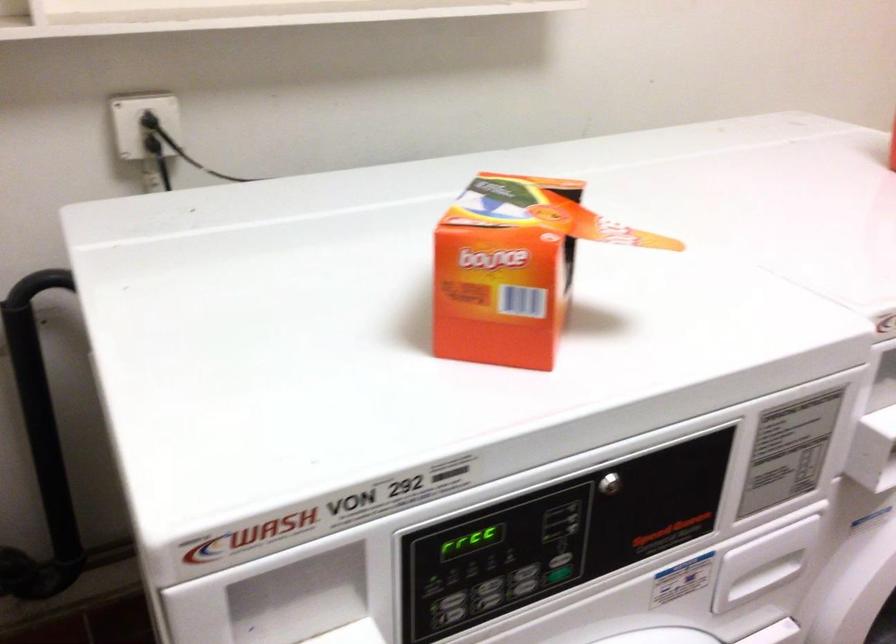
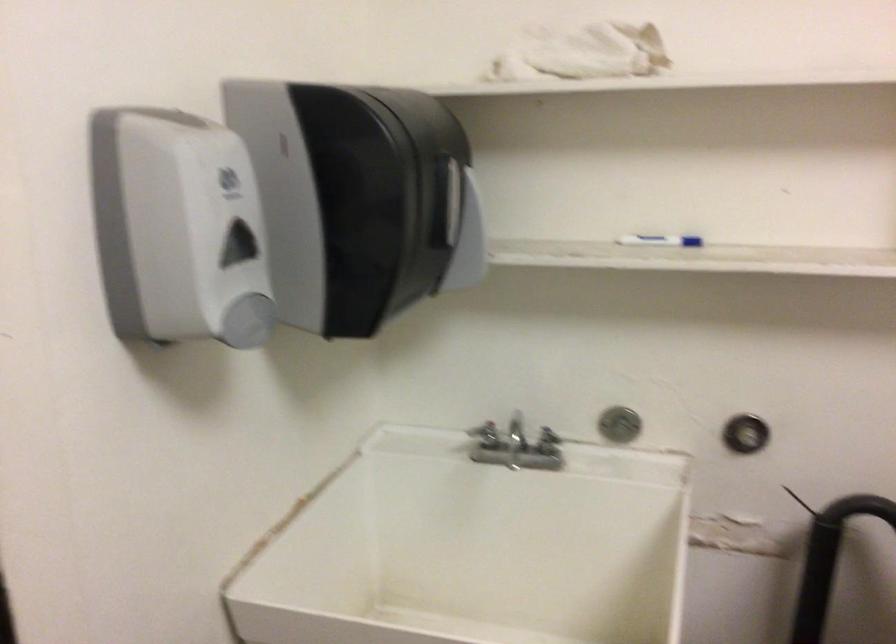
Question: How did the camera likely rotate?

Choices:
 (A) Left
 (B) Right
 (C) Up
 (D) Down

Answer: (A)